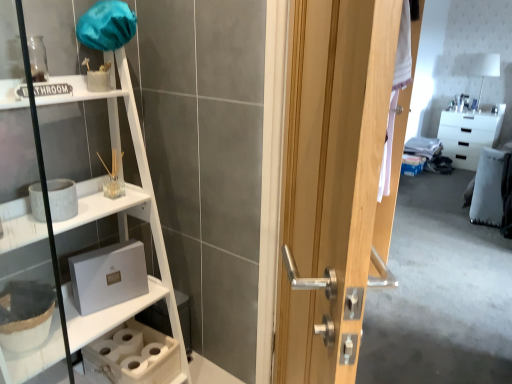
Question: From a real-world perspective, is wooden door at center on top of white glossy cabinet at upper right?

Choices:
 (A) no
 (B) yes

Answer: (B)

Question: Is the depth of wooden door at center less than that of white glossy cabinet at upper right?

Choices:
 (A) no
 (B) yes

Answer: (B)

Question: Is wooden door at center positioned with its back to white glossy cabinet at upper right?

Choices:
 (A) no
 (B) yes

Answer: (A)

Question: From the image's perspective, is wooden door at center located beneath white glossy cabinet at upper right?

Choices:
 (A) yes
 (B) no

Answer: (A)

Question: Is wooden door at center next to white glossy cabinet at upper right?

Choices:
 (A) yes
 (B) no

Answer: (B)

Question: Considering their positions, is wooden door at center located in front of or behind white glossy cabinet at upper right?

Choices:
 (A) front
 (B) behind

Answer: (A)

Question: Considering the relative positions of wooden door at center and white glossy cabinet at upper right in the image provided, is wooden door at center to the left or to the right of white glossy cabinet at upper right?

Choices:
 (A) left
 (B) right

Answer: (A)

Question: From the image's perspective, is wooden door at center positioned above or below white glossy cabinet at upper right?

Choices:
 (A) below
 (B) above

Answer: (A)

Question: Is wooden door at center taller or shorter than white glossy cabinet at upper right?

Choices:
 (A) short
 (B) tall

Answer: (B)

Question: Considering the positions of point (473, 127) and point (346, 364), is point (473, 127) closer or farther from the camera than point (346, 364)?

Choices:
 (A) closer
 (B) farther

Answer: (B)

Question: From the image's perspective, is white glossy cabinet at upper right located above or below wooden door at center?

Choices:
 (A) above
 (B) below

Answer: (A)

Question: From a real-world perspective, is white glossy cabinet at upper right physically located above or below wooden door at center?

Choices:
 (A) below
 (B) above

Answer: (A)

Question: In terms of width, does white glossy cabinet at upper right look wider or thinner when compared to wooden door at center?

Choices:
 (A) wide
 (B) thin

Answer: (A)

Question: Considering the positions of white wood shelf at left and wooden door at center in the image, is white wood shelf at left wider or thinner than wooden door at center?

Choices:
 (A) wide
 (B) thin

Answer: (A)

Question: In terms of size, does white wood shelf at left appear bigger or smaller than wooden door at center?

Choices:
 (A) small
 (B) big

Answer: (B)